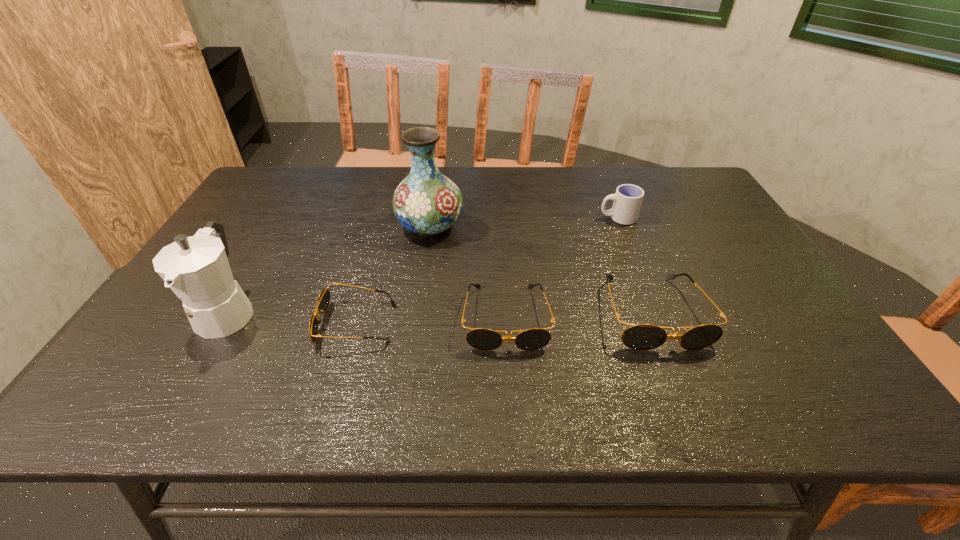
This screenshot has height=540, width=960. In order to click on free space in the image that satisfies the following two spatial constraints: 1. on the front-facing side of the rightmost sunglasses; 2. on the front-facing side of the leftmost sunglasses in this screenshot , I will do `click(657, 323)`.

Identify the location of vacant area that satisfies the following two spatial constraints: 1. with the handle on the side of the cup; 2. on the front-facing side of the second shortest sunglasses. (659, 318).

This screenshot has height=540, width=960. Find the location of `free location that satisfies the following two spatial constraints: 1. with the handle on the side of the cup; 2. on the front-facing side of the rightmost sunglasses`. free location that satisfies the following two spatial constraints: 1. with the handle on the side of the cup; 2. on the front-facing side of the rightmost sunglasses is located at coordinates (657, 313).